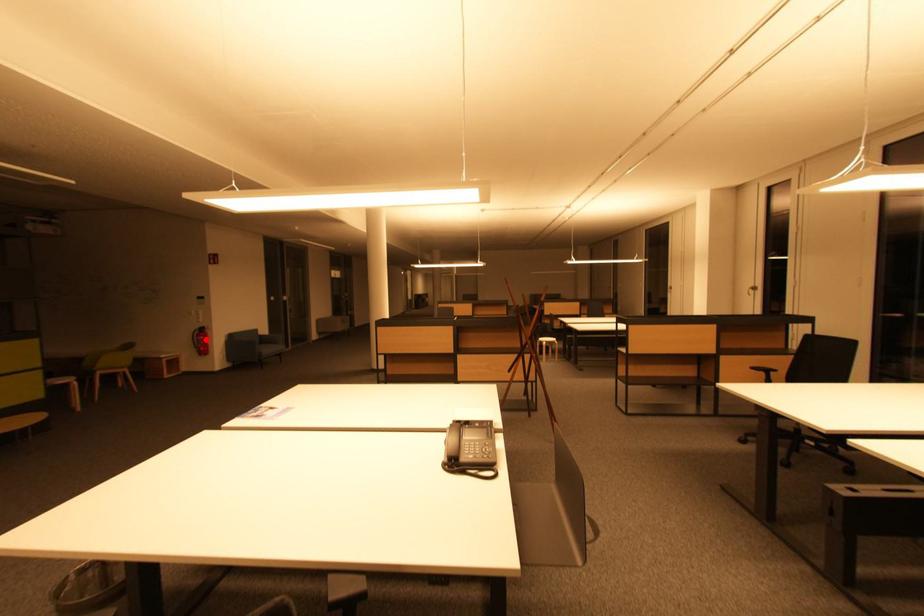
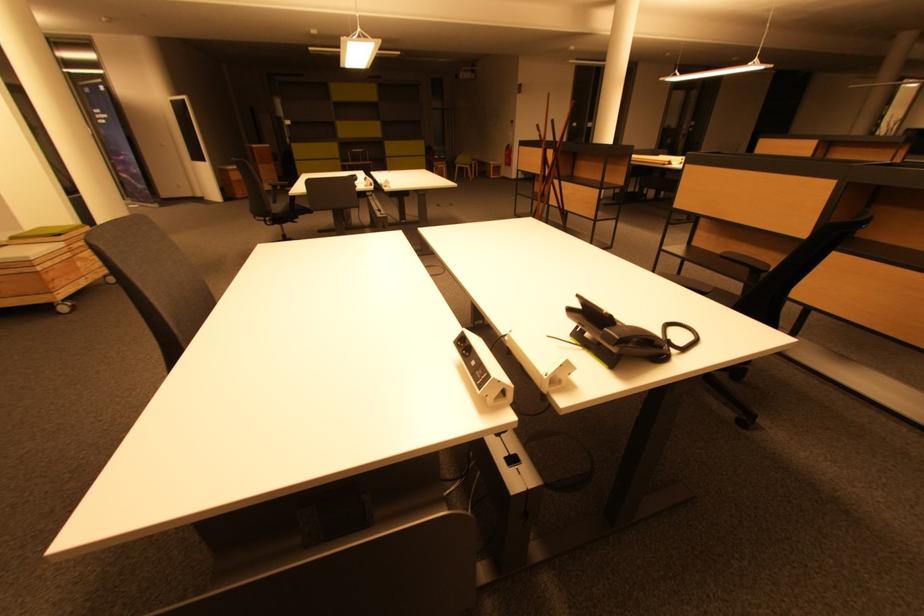
The point at the highlighted location is marked in the first image. Where is the corresponding point in the second image?

(512, 155)